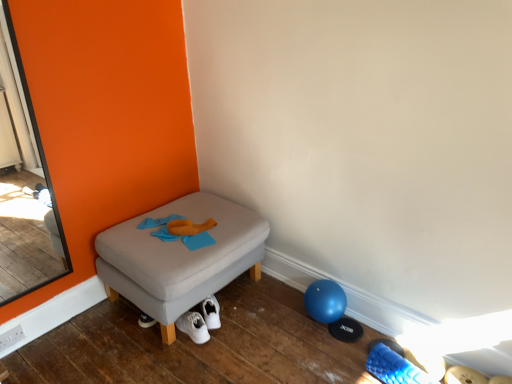
Question: Does white fabric shoe at lower center have a greater width compared to clear glass screen door at left?

Choices:
 (A) yes
 (B) no

Answer: (A)

Question: Is white fabric shoe at lower center shorter than clear glass screen door at left?

Choices:
 (A) no
 (B) yes

Answer: (B)

Question: Could clear glass screen door at left be considered to be inside white fabric shoe at lower center?

Choices:
 (A) yes
 (B) no

Answer: (B)

Question: Considering the relative sizes of white fabric shoe at lower center and clear glass screen door at left in the image provided, is white fabric shoe at lower center smaller than clear glass screen door at left?

Choices:
 (A) no
 (B) yes

Answer: (B)

Question: Is white fabric shoe at lower center not near clear glass screen door at left?

Choices:
 (A) yes
 (B) no

Answer: (A)

Question: Does point (7, 117) appear closer or farther from the camera than point (415, 382)?

Choices:
 (A) closer
 (B) farther

Answer: (B)

Question: In the image, is clear glass screen door at left positioned in front of or behind white fabric shoe at lower center?

Choices:
 (A) behind
 (B) front

Answer: (B)

Question: Choose the correct answer: Is clear glass screen door at left inside white fabric shoe at lower center or outside it?

Choices:
 (A) outside
 (B) inside

Answer: (A)

Question: Considering the relative positions of clear glass screen door at left and white fabric shoe at lower center in the image provided, is clear glass screen door at left to the left or to the right of white fabric shoe at lower center?

Choices:
 (A) right
 (B) left

Answer: (B)

Question: Is matte gray ottoman at center in front of or behind white fabric shoe at lower center in the image?

Choices:
 (A) front
 (B) behind

Answer: (B)

Question: Looking at their shapes, would you say matte gray ottoman at center is wider or thinner than white fabric shoe at lower center?

Choices:
 (A) wide
 (B) thin

Answer: (A)

Question: From the image's perspective, relative to white fabric shoe at lower center, is matte gray ottoman at center above or below?

Choices:
 (A) below
 (B) above

Answer: (B)

Question: Considering the positions of matte gray ottoman at center and white fabric shoe at lower center in the image, is matte gray ottoman at center taller or shorter than white fabric shoe at lower center?

Choices:
 (A) tall
 (B) short

Answer: (A)

Question: From the image's perspective, is white fabric shoe at lower center positioned above or below clear glass screen door at left?

Choices:
 (A) above
 (B) below

Answer: (B)

Question: Considering the relative positions of white fabric shoe at lower center and clear glass screen door at left in the image provided, is white fabric shoe at lower center to the left or to the right of clear glass screen door at left?

Choices:
 (A) left
 (B) right

Answer: (B)